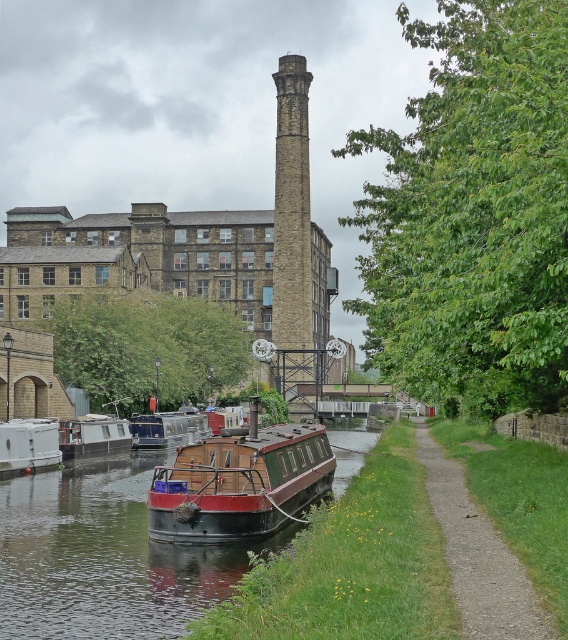
Question: Where is wooden polished barge at center located in relation to gravel path at lower right in the image?

Choices:
 (A) below
 (B) above

Answer: (B)

Question: Which point is closer to the camera?

Choices:
 (A) wooden boat at center
 (B) stone brick tower at center

Answer: (A)

Question: Which of the following is the closest to the observer?

Choices:
 (A) wooden boat at center
 (B) wooden polished barge at center
 (C) white matte boat at lower left

Answer: (B)

Question: Can you confirm if gravel path at lower right is positioned to the right of white matte boat at lower left?

Choices:
 (A) yes
 (B) no

Answer: (A)

Question: Which object is farther from the camera taking this photo?

Choices:
 (A) gravel path at lower right
 (B) white matte boat at lower left

Answer: (B)

Question: Does smooth wooden boat at center have a larger size compared to wooden polished barge at center?

Choices:
 (A) yes
 (B) no

Answer: (A)